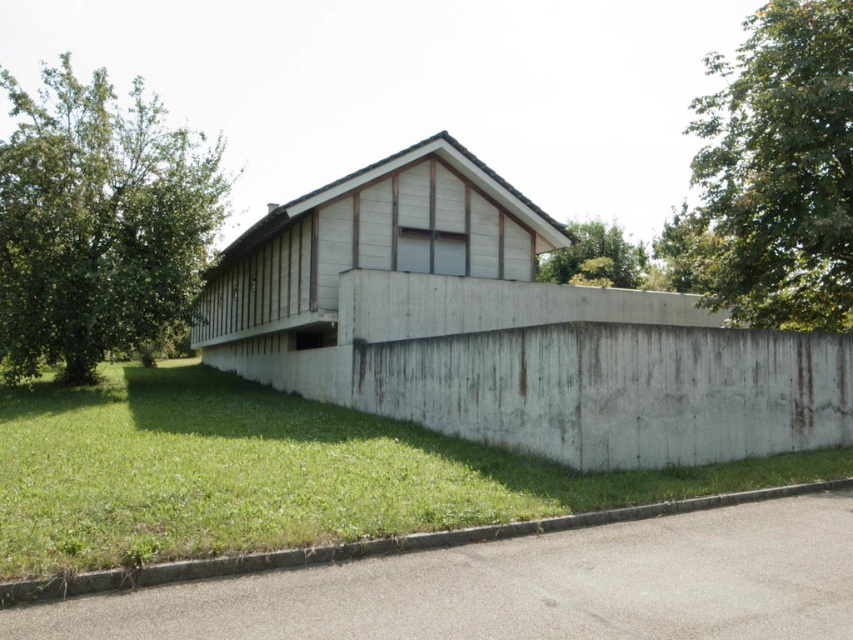
Question: Which object is positioned farthest from the gray concrete curb at lower right?

Choices:
 (A) green leafy tree at upper center
 (B) green grass at lower left
 (C) green leafy tree at left
 (D) green leafy tree at upper right

Answer: (C)

Question: Which object is closer to the camera taking this photo?

Choices:
 (A) green leafy tree at upper center
 (B) gray concrete curb at lower right
 (C) green leafy tree at left
 (D) green grass at lower left

Answer: (D)

Question: Does gray concrete curb at lower right come in front of green leafy tree at upper right?

Choices:
 (A) yes
 (B) no

Answer: (A)

Question: Is green grass at lower left smaller than green leafy tree at left?

Choices:
 (A) yes
 (B) no

Answer: (A)

Question: Which of the following is the closest to the observer?

Choices:
 (A) green leafy tree at left
 (B) gray concrete curb at lower right
 (C) green leafy tree at upper right

Answer: (B)

Question: Is green leafy tree at left closer to the viewer compared to green leafy tree at upper center?

Choices:
 (A) no
 (B) yes

Answer: (B)